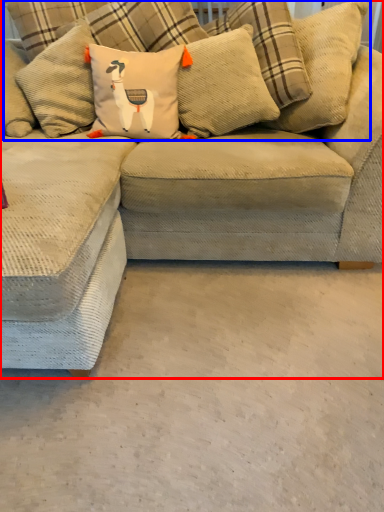
Question: Which of the following is the closest to the observer, studio couch (highlighted by a red box) or pillow (highlighted by a blue box)?

Choices:
 (A) studio couch
 (B) pillow

Answer: (A)